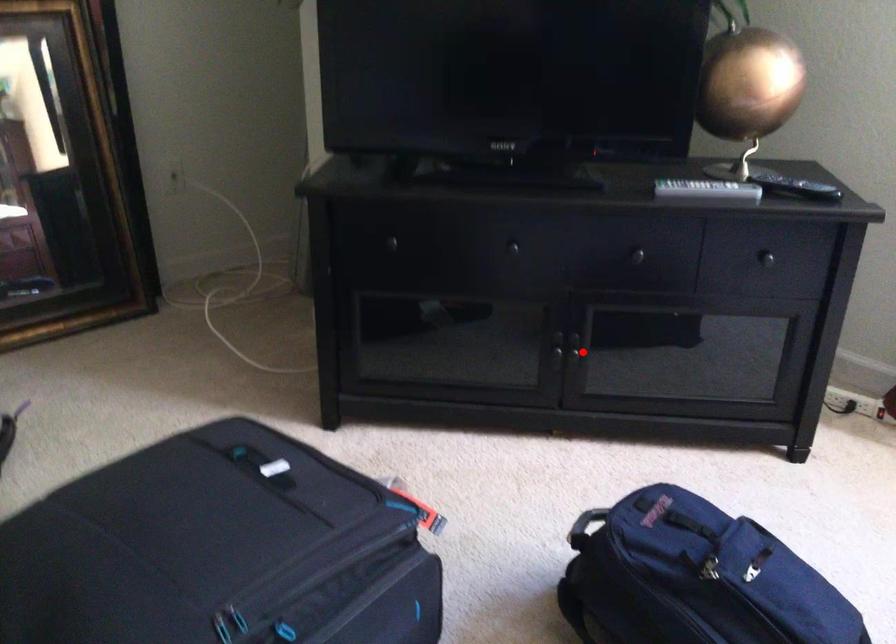
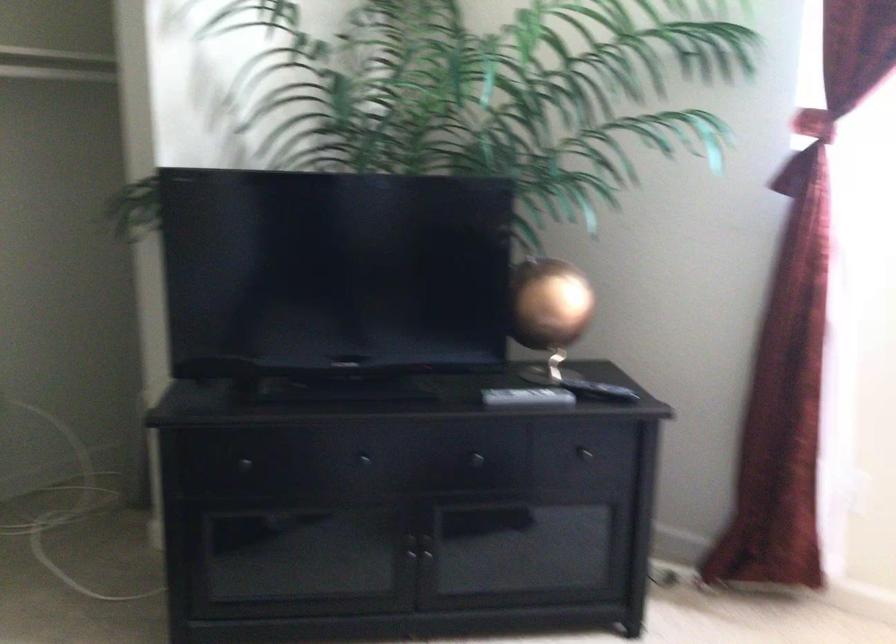
Where in the second image is the point corresponding to the highlighted location from the first image?

(434, 550)